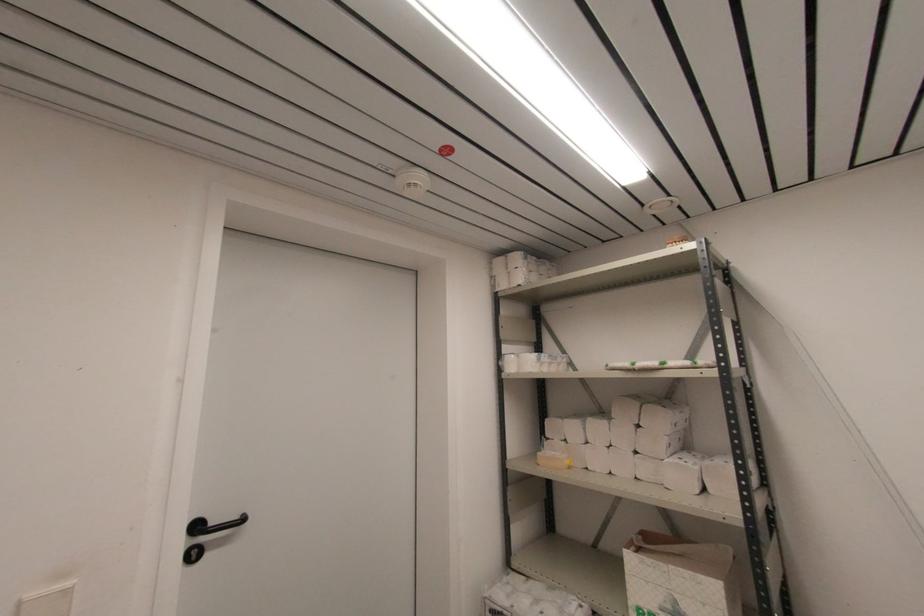
Where would you lift the paper towel pack? Please return your answer as a coordinate pair (x, y).

(523, 268)